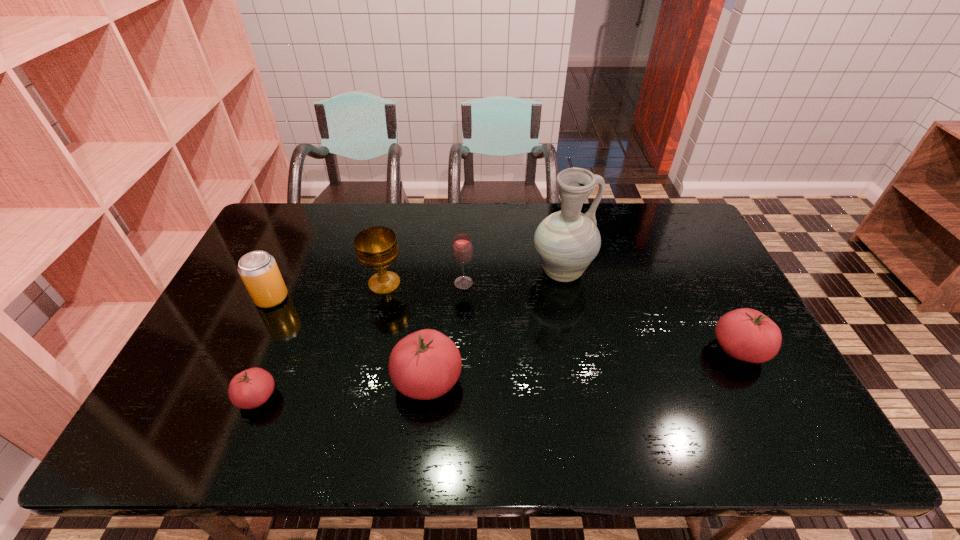
The height and width of the screenshot is (540, 960). I want to click on vacant area at the near edge of the desktop, so click(529, 399).

Locate an element on the screen. The image size is (960, 540). free space at the left edge is located at coordinates (212, 340).

The width and height of the screenshot is (960, 540). In order to click on vacant region at the right edge of the desktop in this screenshot , I will do `click(702, 329)`.

Find the location of `vacant area between the glass drink container and the chalice`. vacant area between the glass drink container and the chalice is located at coordinates (424, 284).

The image size is (960, 540). Identify the location of free space between the second tomato from right to left and the tallest object. (494, 327).

You are a GUI agent. You are given a task and a screenshot of the screen. Output one action in this format:
    pyautogui.click(x=<x>, y=<y>)
    Task: Click on the free space between the shortest object and the rightmost object
    
    Given the screenshot: What is the action you would take?
    pyautogui.click(x=498, y=374)

At what (x,y) coordinates should I click in order to perform the action: click on vacant area that lies between the second tomato from left to right and the pop (soda). Please return your answer as a coordinate pair (x, y). Looking at the image, I should click on (349, 339).

Where is `vacant region between the pop (soda) and the shortest tomato`? The image size is (960, 540). vacant region between the pop (soda) and the shortest tomato is located at coordinates (264, 348).

This screenshot has width=960, height=540. Find the location of `free area in between the pop (soda) and the chalice`. free area in between the pop (soda) and the chalice is located at coordinates (328, 291).

This screenshot has height=540, width=960. Identify the location of free space between the glass drink container and the second tomato from right to left. [x=445, y=332].